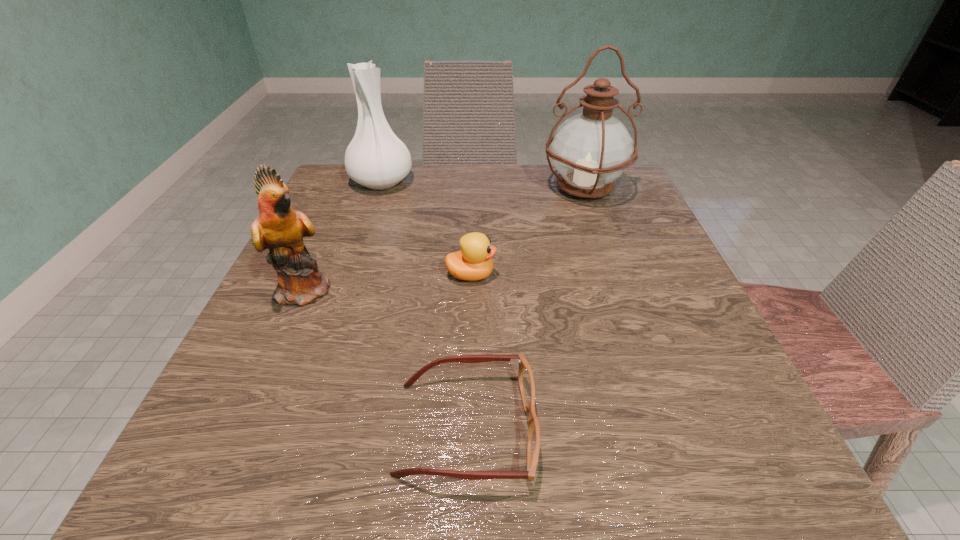
You are a GUI agent. You are given a task and a screenshot of the screen. Output one action in this format:
    pyautogui.click(x=<x>, y=<y>)
    Task: Click on the vacant area between the vase and the shortest object
    Image resolution: width=960 pixels, height=540 pixels.
    Given the screenshot: What is the action you would take?
    pyautogui.click(x=423, y=305)

Find the location of `vacant area that lies between the parrot and the shortest object`. vacant area that lies between the parrot and the shortest object is located at coordinates (386, 359).

You are a GUI agent. You are given a task and a screenshot of the screen. Output one action in this format:
    pyautogui.click(x=<x>, y=<y>)
    Task: Click on the free spot between the fourth tallest object and the nearest object
    
    Given the screenshot: What is the action you would take?
    pyautogui.click(x=468, y=352)

The width and height of the screenshot is (960, 540). Identify the location of free area in between the parrot and the second shortest object. (389, 282).

You are a GUI agent. You are given a task and a screenshot of the screen. Output one action in this format:
    pyautogui.click(x=<x>, y=<y>)
    Task: Click on the unoccupied position between the rightmost object and the nearest object
    
    Given the screenshot: What is the action you would take?
    pyautogui.click(x=525, y=308)

The image size is (960, 540). I want to click on vacant point located between the vase and the parrot, so click(344, 235).

This screenshot has width=960, height=540. I want to click on empty space that is in between the parrot and the rightmost object, so click(x=445, y=238).

Locate which object ranks second in proximity to the duckling. Please provide its 2D coordinates. Your answer should be formatted as a tuple, i.e. [(x, y)], where the tuple contains the x and y coordinates of a point satisfying the conditions above.

[(279, 228)]

Locate which object ranks third in proximity to the duckling. Please provide its 2D coordinates. Your answer should be formatted as a tuple, i.e. [(x, y)], where the tuple contains the x and y coordinates of a point satisfying the conditions above.

[(590, 150)]